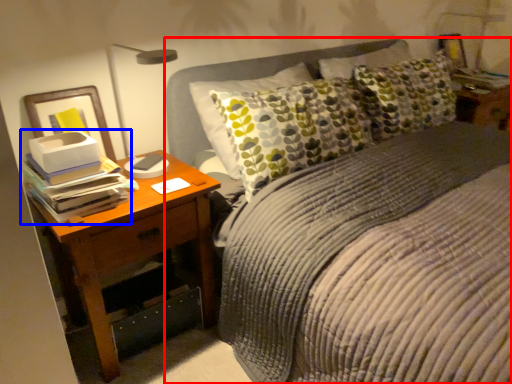
Question: Which of the following is the farthest to the observer, bed (highlighted by a red box) or book (highlighted by a blue box)?

Choices:
 (A) bed
 (B) book

Answer: (B)